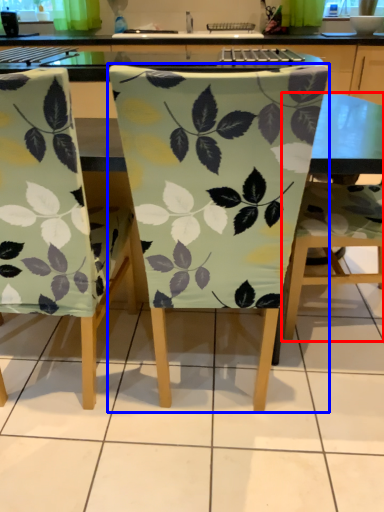
Question: Which point is further to the camera, chair (highlighted by a red box) or chair (highlighted by a blue box)?

Choices:
 (A) chair
 (B) chair

Answer: (A)